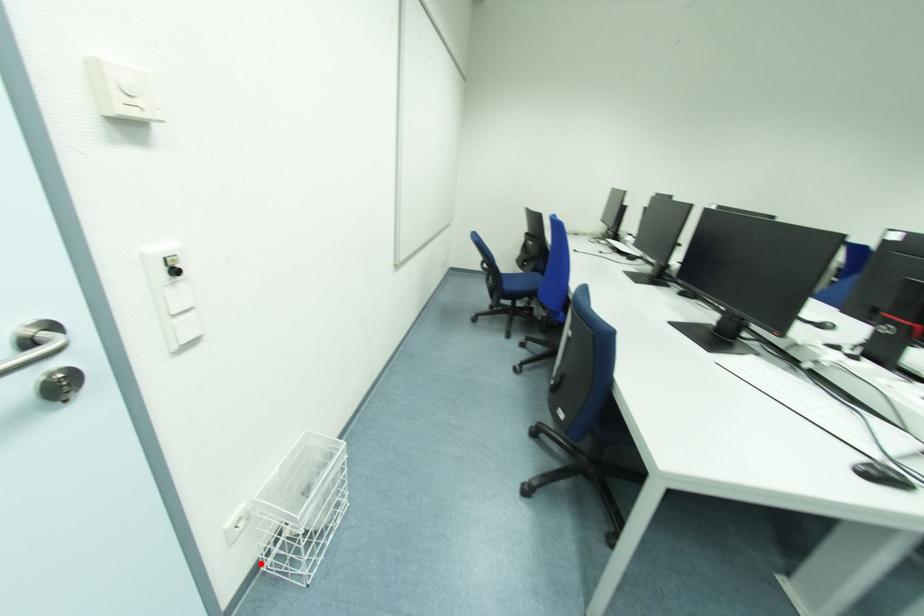
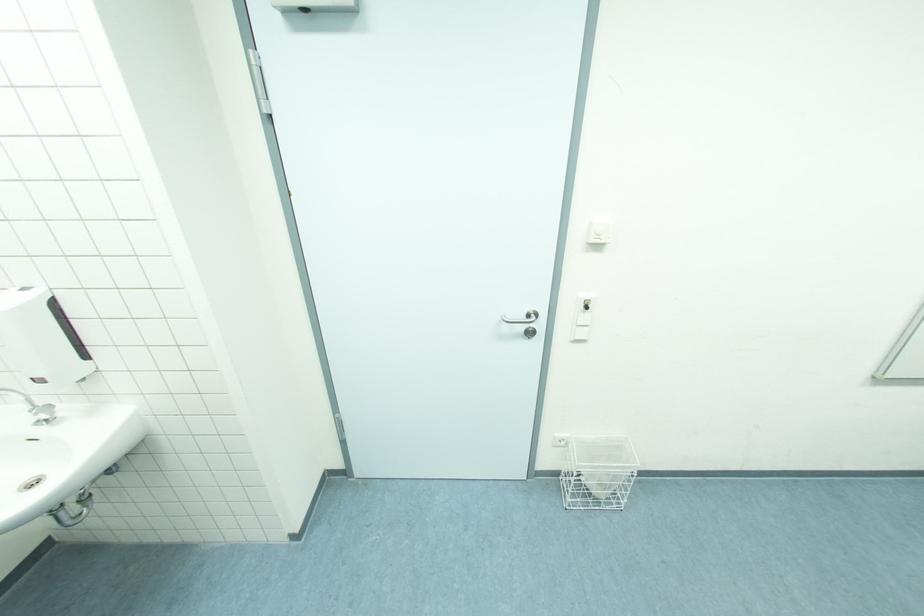
Question: I am providing you with two images of the same scene from different viewpoints. A red point is shown in image1. For the corresponding object point in image2, is it positioned nearer or farther from the camera?

Choices:
 (A) Nearer
 (B) Farther

Answer: (B)